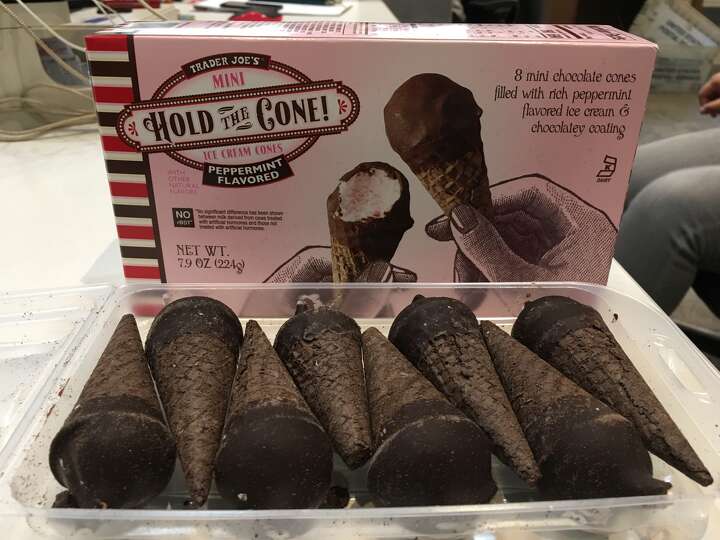
Where is `tables`? Image resolution: width=720 pixels, height=540 pixels. tables is located at coordinates (62, 235).